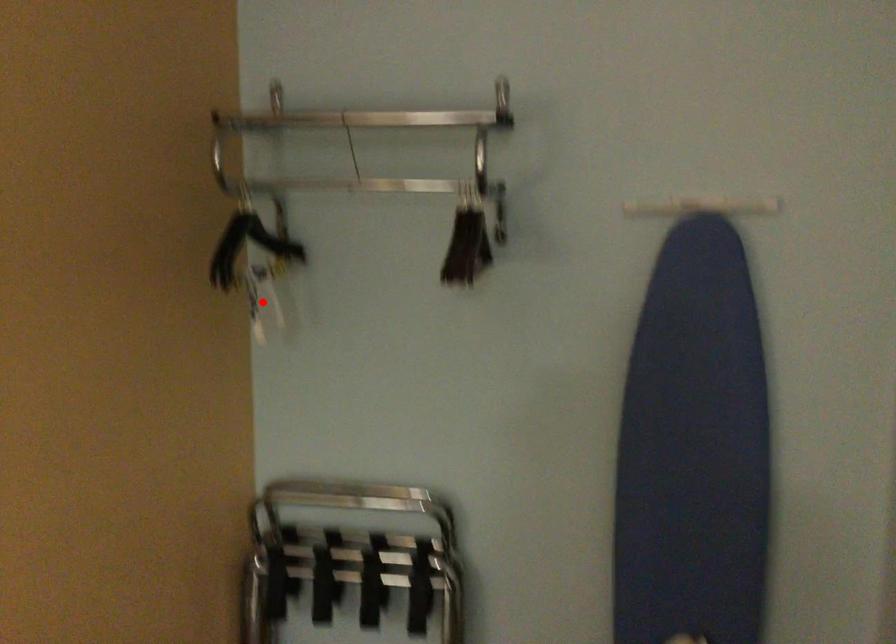
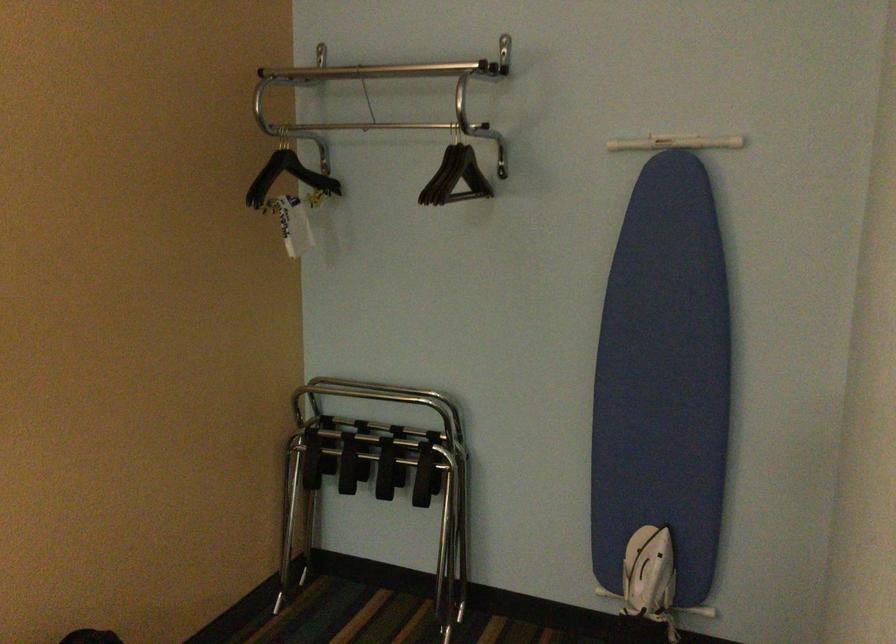
Find the pixel in the second image that matches the highlighted location in the first image.

(291, 223)